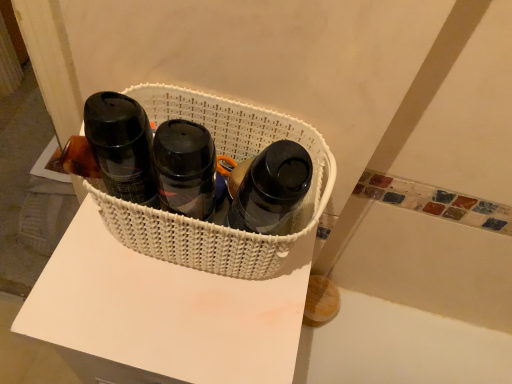
Question: In terms of height, does white woven basket at center look taller or shorter compared to matte black bottle at center, placed as the second bottle when sorted from left to right?

Choices:
 (A) short
 (B) tall

Answer: (B)

Question: Which is correct: white woven basket at center is inside matte black bottle at center, placed as the second bottle when sorted from left to right, or outside of it?

Choices:
 (A) outside
 (B) inside

Answer: (A)

Question: Which object is positioned closest to the white woven basket at center?

Choices:
 (A) matte black bottle at center, which ranks as the first bottle in right-to-left order
 (B) matte black thermos at left, marked as the 1th bottle in a left-to-right arrangement
 (C) white woven basket at center

Answer: (C)

Question: Estimate the real-world distances between objects in this image. Which object is closer to the matte black bottle at center, which ranks as the first bottle in right-to-left order?

Choices:
 (A) white woven basket at center
 (B) matte black thermos at left, marked as the 1th bottle in a left-to-right arrangement
 (C) white woven basket at center

Answer: (C)